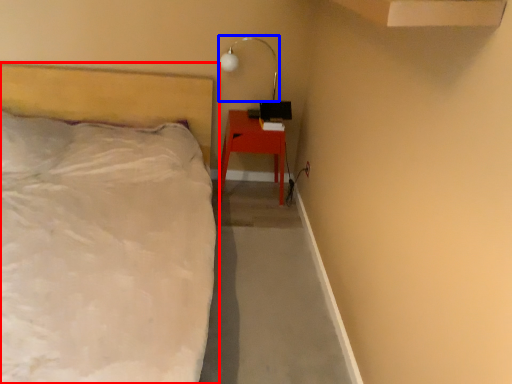
Question: Which object appears closest to the camera in this image, bed (highlighted by a red box) or lamp (highlighted by a blue box)?

Choices:
 (A) bed
 (B) lamp

Answer: (A)